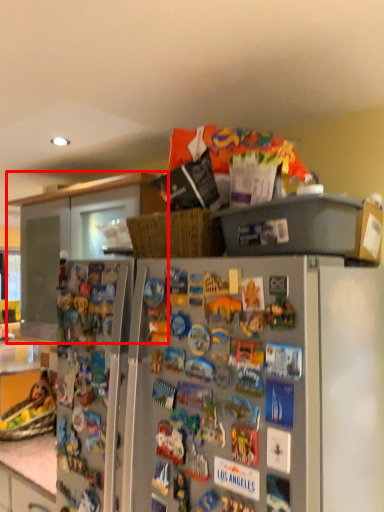
Question: From the image's perspective, what is the correct spatial relationship of cabinetry (annotated by the red box) in relation to refrigerator?

Choices:
 (A) above
 (B) below

Answer: (A)